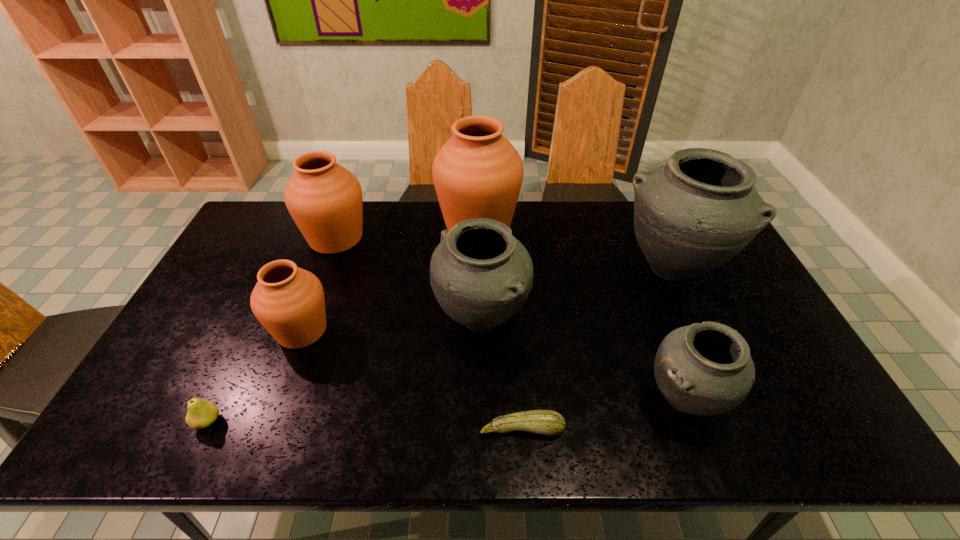
Point out which black urn is positioned as the second nearest to the smallest black urn. Please provide its 2D coordinates. Your answer should be formatted as a tuple, i.e. [(x, y)], where the tuple contains the x and y coordinates of a point satisfying the conditions above.

[(481, 275)]

The image size is (960, 540). What are the coordinates of `black urn that can be found as the third closest to the second shortest object` in the screenshot? It's located at (691, 215).